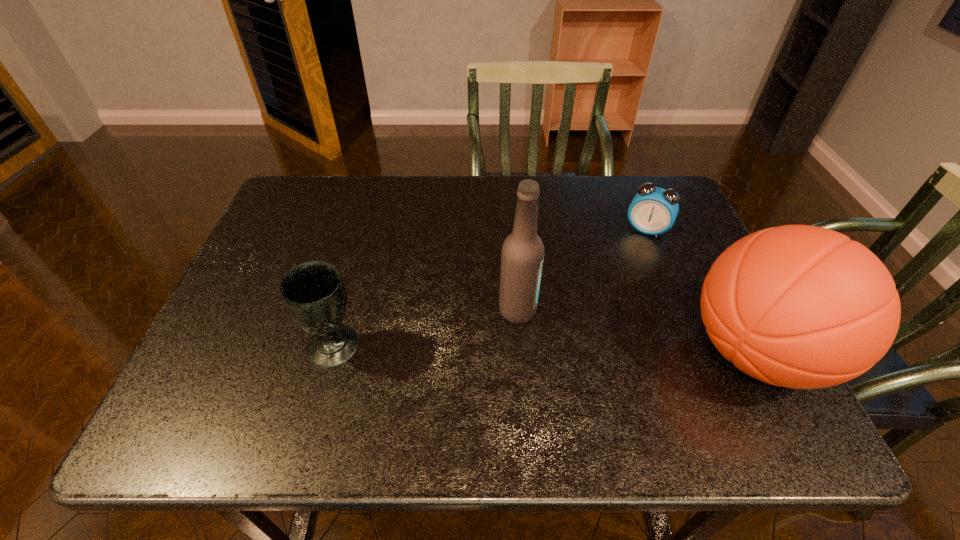
Where is `object located in the near right corner section of the desktop`? Image resolution: width=960 pixels, height=540 pixels. object located in the near right corner section of the desktop is located at coordinates (798, 306).

In the image, there is a desktop. At what (x,y) coordinates should I click in order to perform the action: click on free space at the far edge. Please return your answer as a coordinate pair (x, y). Image resolution: width=960 pixels, height=540 pixels. Looking at the image, I should click on (456, 175).

Where is `free space at the near edge of the desktop`? free space at the near edge of the desktop is located at coordinates (311, 393).

In the image, there is a desktop. Identify the location of free region at the left edge. The image size is (960, 540). (233, 310).

The height and width of the screenshot is (540, 960). In order to click on free space at the right edge in this screenshot , I will do `click(691, 280)`.

The width and height of the screenshot is (960, 540). What are the coordinates of `vacant region at the near right corner of the desktop` in the screenshot? It's located at (709, 389).

Where is `free space between the basketball and the second object from left to right`? The width and height of the screenshot is (960, 540). free space between the basketball and the second object from left to right is located at coordinates (636, 331).

At what (x,y) coordinates should I click in order to perform the action: click on vacant area that lies between the alarm clock and the leftmost object. Please return your answer as a coordinate pair (x, y). Image resolution: width=960 pixels, height=540 pixels. Looking at the image, I should click on click(x=491, y=288).

What are the coordinates of `free space between the basketball and the chalice` in the screenshot? It's located at (544, 349).

Where is `empty space between the beer bottle and the basketball`? This screenshot has width=960, height=540. empty space between the beer bottle and the basketball is located at coordinates (636, 331).